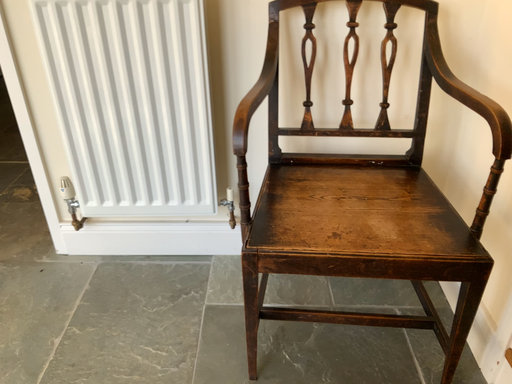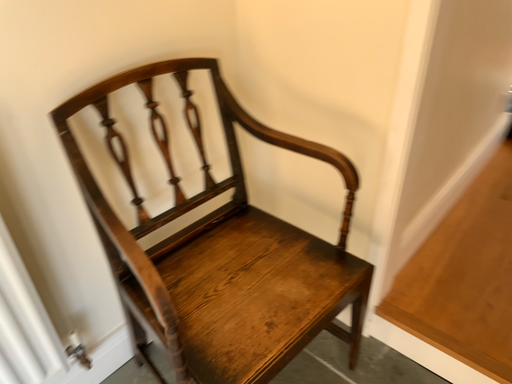
Question: How did the camera likely rotate when shooting the video?

Choices:
 (A) rotated right
 (B) rotated left

Answer: (A)